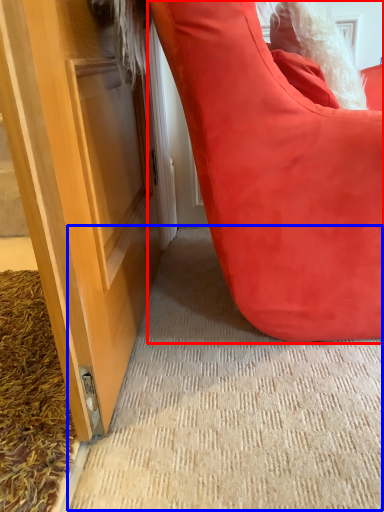
Question: Which of the following is the farthest to the observer, furniture (highlighted by a red box) or doormat (highlighted by a blue box)?

Choices:
 (A) furniture
 (B) doormat

Answer: (B)